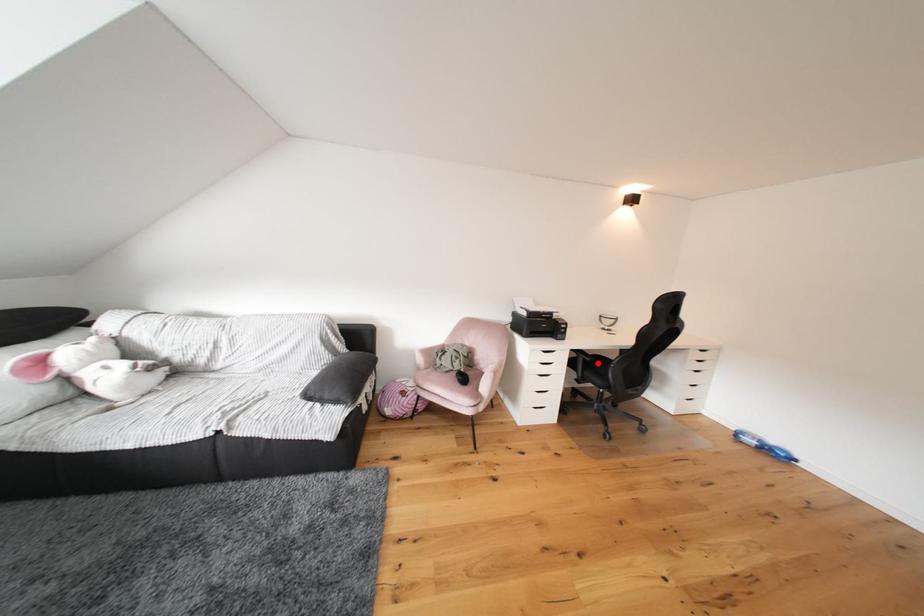
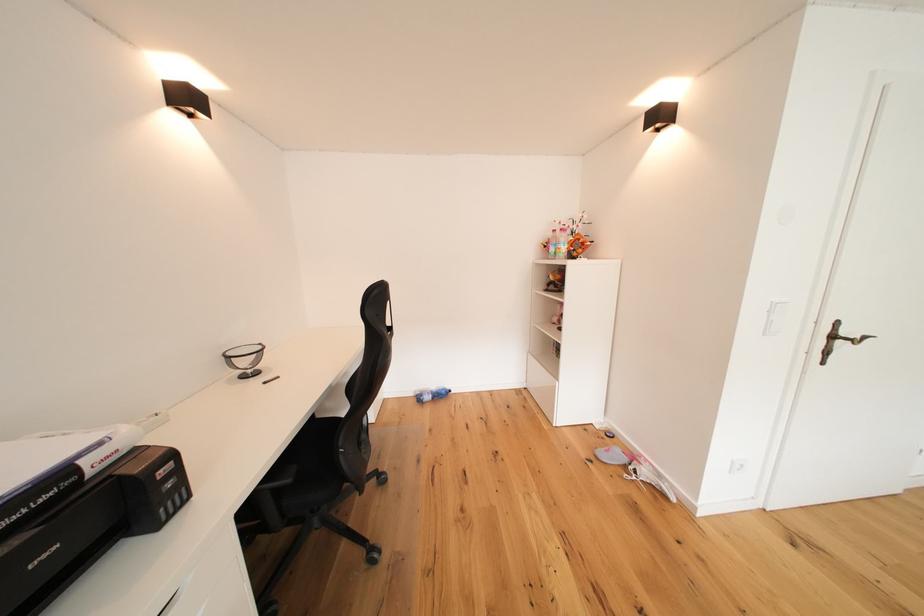
Question: I am providing you with two images of the same scene from different viewpoints. In image1, a red point is highlighted. Considering the same 3D point in image2, which of the following is correct?

Choices:
 (A) It is closer
 (B) It is farther

Answer: (A)